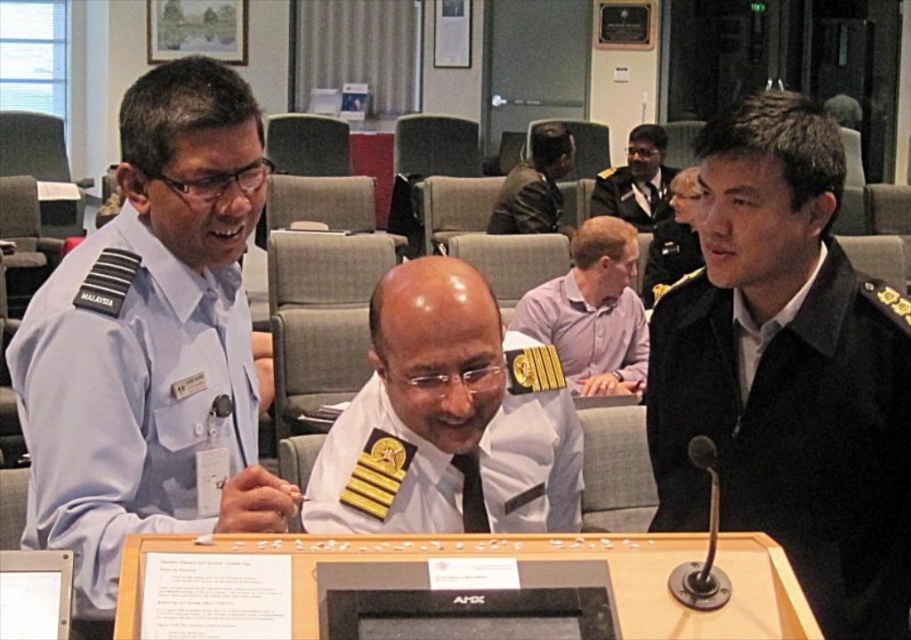
In the formal meeting scene, there are two central figures wearing uniforms. The white uniform at center and the black uniform at center. Which one is positioned to the left?

The white uniform at center is positioned to the left of the black uniform at center.

Based on the scene description, which of the two uniforms, the light blue fabric uniform at left or the black uniform at center, is positioned lower in the image?

The light blue fabric uniform at left is positioned below the black uniform at center, so it is lower in the image.

You are a photographer standing behind the table where the light blue fabric uniform at left and the pink shirt at center are seated. You want to take a photo that includes both individuals without any obstructions. Given that your camera has a maximum focus range of 8 feet, will you be able to capture both subjects clearly in the same frame?

The distance between the light blue fabric uniform at left and the pink shirt at center is 8.18 feet. Since the camera can only focus up to 8 feet, the subjects are slightly out of range. To capture both clearly, you might need to adjust their positions or use a different camera with a longer focus range.